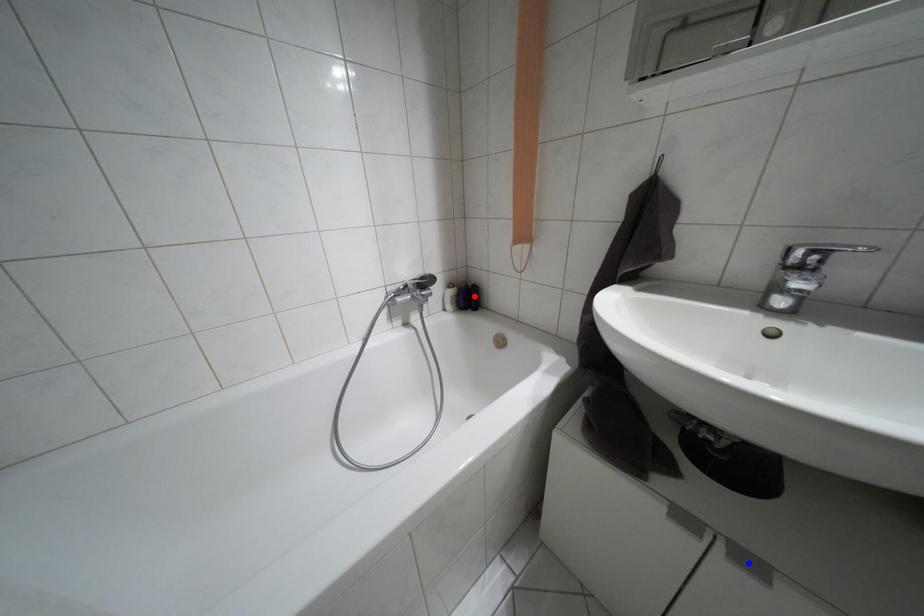
Question: In the image, two points are highlighted. Which point is nearer to the camera? Reply with the corresponding letter.

Choices:
 (A) blue point
 (B) red point

Answer: (A)